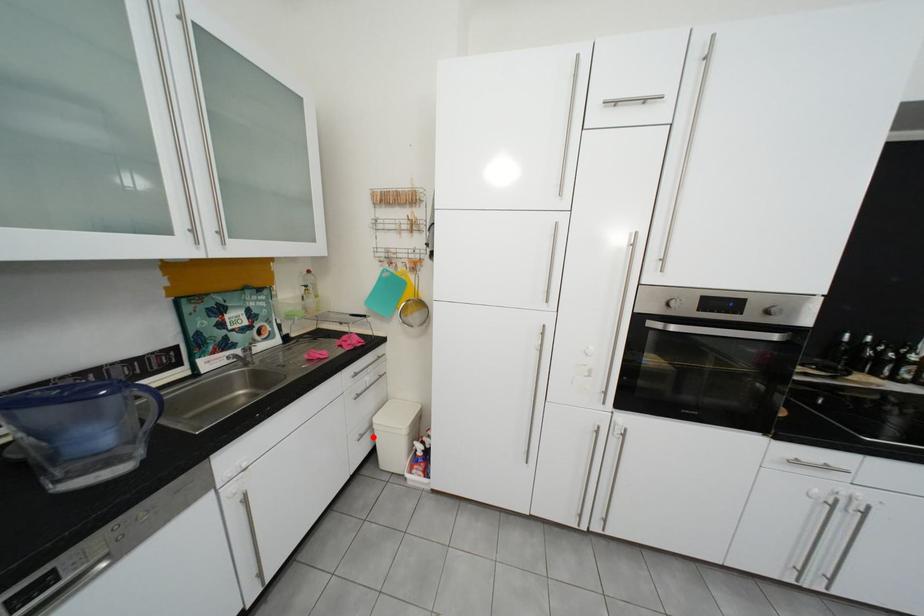
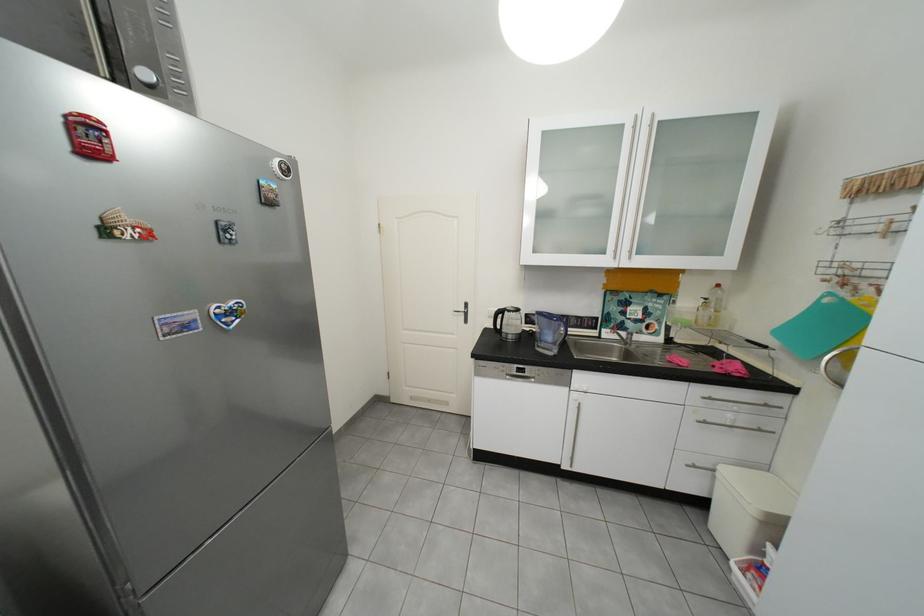
In the second image, find the point that corresponds to the highlighted location in the first image.

(707, 468)